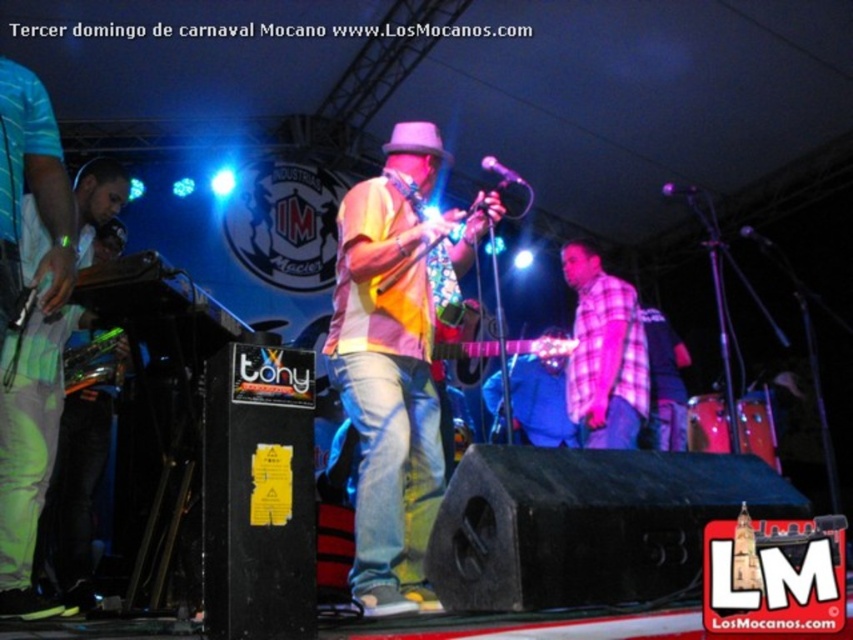
Does multicolored fabric shirt at center appear over pink plaid shirt at center?

Correct, multicolored fabric shirt at center is located above pink plaid shirt at center.

The image size is (853, 640). What do you see at coordinates (392, 381) in the screenshot?
I see `multicolored fabric shirt at center` at bounding box center [392, 381].

This screenshot has width=853, height=640. Describe the element at coordinates (392, 381) in the screenshot. I see `multicolored fabric shirt at center` at that location.

Locate an element on the screen. This screenshot has width=853, height=640. multicolored fabric shirt at center is located at coordinates (392, 381).